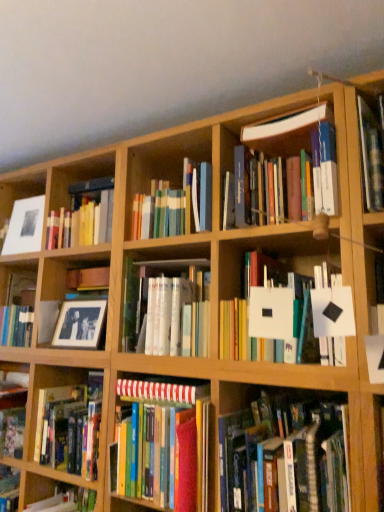
Question: Which direction should I rotate to look at white glossy book at center, which appears as the fourth book when ordered from the bottom, — up or down?

Choices:
 (A) up
 (B) down

Answer: (B)

Question: Does hardcover book at lower right, which is counted as the 3th book, starting from the bottom, have a lesser height compared to black matte photo frame at left?

Choices:
 (A) yes
 (B) no

Answer: (B)

Question: From a real-world perspective, is hardcover book at lower right, which appears as the fourth book when viewed from the top, physically above black matte photo frame at left?

Choices:
 (A) no
 (B) yes

Answer: (A)

Question: Is hardcover book at lower right, which is counted as the 3th book, starting from the bottom, not within black matte photo frame at left?

Choices:
 (A) no
 (B) yes

Answer: (B)

Question: Does hardcover book at lower right, which is counted as the 3th book, starting from the bottom, have a greater width compared to black matte photo frame at left?

Choices:
 (A) no
 (B) yes

Answer: (A)

Question: Is hardcover book at lower right, which appears as the fourth book when viewed from the top, placed right next to black matte photo frame at left?

Choices:
 (A) yes
 (B) no

Answer: (B)

Question: Is hardcover book at lower right, which is counted as the 3th book, starting from the bottom, bigger than black matte photo frame at left?

Choices:
 (A) no
 (B) yes

Answer: (A)

Question: Is matte black picture frame at center-left, which ranks as the 2th picture frame in top-to-bottom order, positioned beyond the bounds of matte white picture frame at upper left, which is counted as the first picture frame, starting from the left?

Choices:
 (A) no
 (B) yes

Answer: (B)

Question: Does matte black picture frame at center-left, the second picture frame in the back-to-front sequence, have a larger size compared to matte white picture frame at upper left, which is counted as the first picture frame, starting from the left?

Choices:
 (A) no
 (B) yes

Answer: (A)

Question: From a real-world perspective, does matte black picture frame at center-left, which is the first picture frame in right-to-left order, sit lower than matte white picture frame at upper left, placed as the second picture frame when sorted from front to back?

Choices:
 (A) no
 (B) yes

Answer: (B)

Question: Could you tell me if matte black picture frame at center-left, positioned as the second picture frame in left-to-right order, is facing matte white picture frame at upper left, the first picture frame viewed from the back?

Choices:
 (A) yes
 (B) no

Answer: (B)

Question: Does matte black picture frame at center-left, positioned as the second picture frame in left-to-right order, have a lesser height compared to matte white picture frame at upper left, which is counted as the first picture frame, starting from the left?

Choices:
 (A) no
 (B) yes

Answer: (B)

Question: Does matte black picture frame at center-left, marked as the 1th picture frame in a front-to-back arrangement, appear on the left side of matte white picture frame at upper left, the first picture frame viewed from the back?

Choices:
 (A) no
 (B) yes

Answer: (A)

Question: Can you confirm if white glossy book at center, which appears as the fourth book when ordered from the bottom, is thinner than hardcover books at center, the sixth book from the top?

Choices:
 (A) yes
 (B) no

Answer: (B)